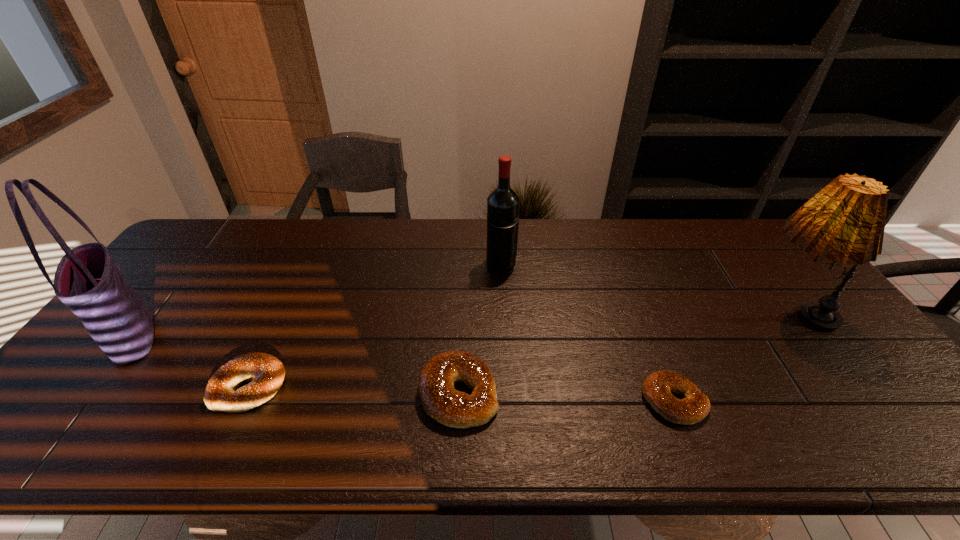
This screenshot has width=960, height=540. I want to click on free space that satisfies the following two spatial constraints: 1. on the front side of the farthest object; 2. on the left side of the fifth object from left to right, so click(x=509, y=401).

At what (x,y) coordinates should I click in order to perform the action: click on vacant area that satisfies the following two spatial constraints: 1. on the front side of the second tallest bagel; 2. on the left side of the second bagel from left to right. Please return your answer as a coordinate pair (x, y). Looking at the image, I should click on (x=246, y=393).

Identify the location of vacant region that satisfies the following two spatial constraints: 1. on the front side of the tote bag; 2. on the left side of the second bagel from right to left. (90, 393).